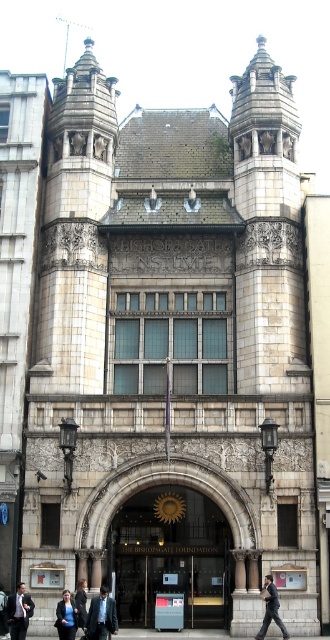
You are standing in front of The Bishopsgate Institute and see a dark blue suit at center and a dark suit at center. Which one is positioned to the right?

The dark blue suit at center is positioned to the right of the dark suit at center.

You are a tailor measuring suits for alterations. You have two suits to assess in the image of The Bishopsgate Institute exterior. The dark suit at center and the dark blue suit at lower left. Which suit requires a wider alteration table to accommodate its width?

The dark suit at center requires a wider alteration table because its width is larger than the dark blue suit at lower left.

You are standing at the entrance of The Bishopsgate Institute and see two suits displayed at the center. How far apart are the dark suit at center and the dark gray suit at center?

The dark suit at center is 53.86 feet away from the dark gray suit at center.